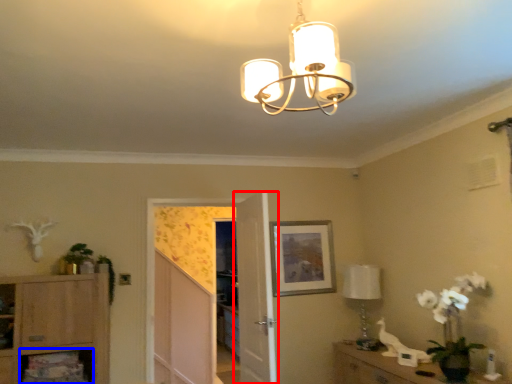
Question: Among these objects, which one is nearest to the camera, door (highlighted by a red box) or shelf (highlighted by a blue box)?

Choices:
 (A) door
 (B) shelf

Answer: (A)